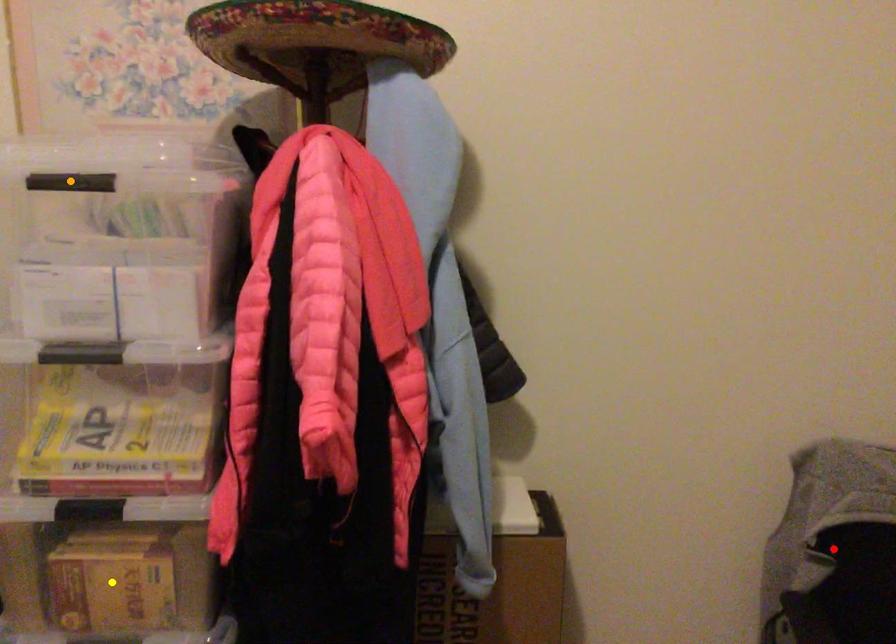
Order these from nearest to farthest:
red point | yellow point | orange point

orange point → yellow point → red point